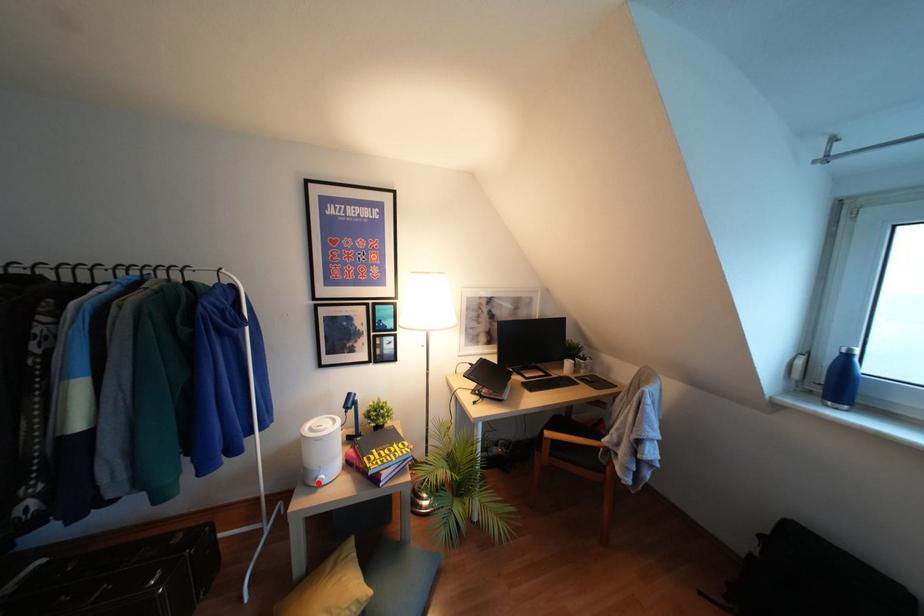
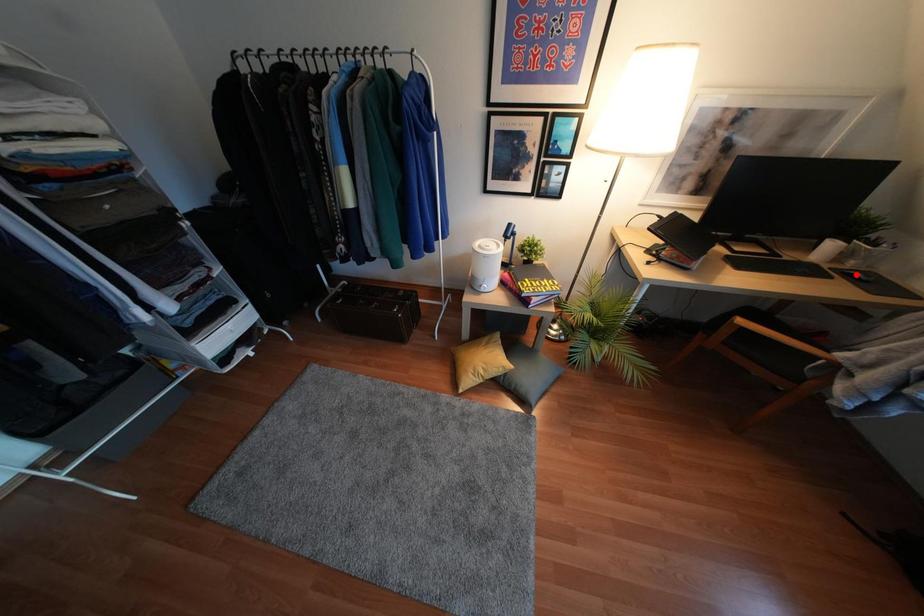
I am providing you with two images of the same scene from different viewpoints. A red point is marked on the first image and another point is marked on the second image. Is the red point in image1 aligned with the point shown in image2?

No